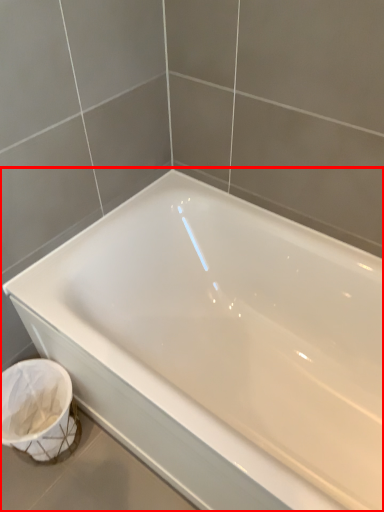
Question: Observing the image, what is the correct spatial positioning of bathtub (annotated by the red box) in reference to laundry basket?

Choices:
 (A) left
 (B) right

Answer: (B)